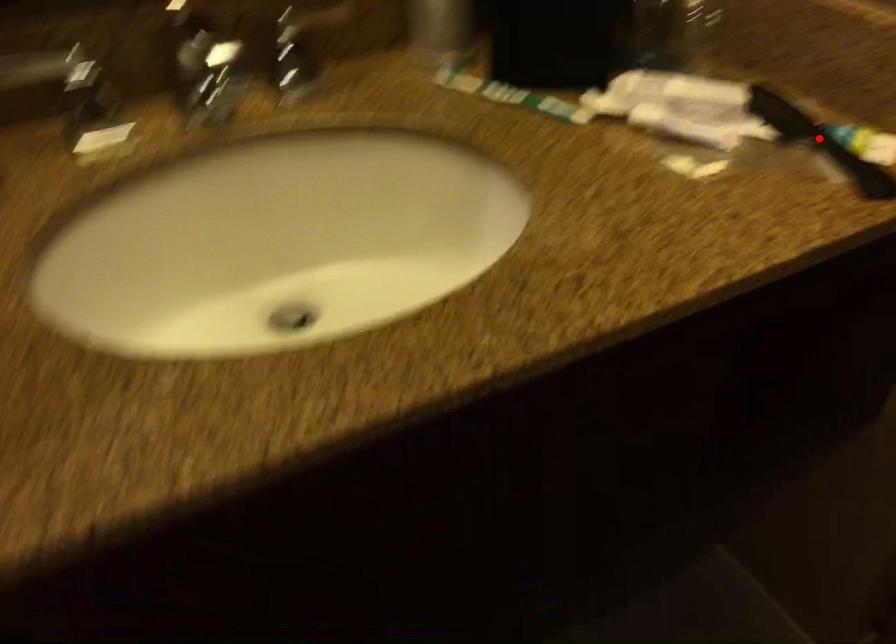
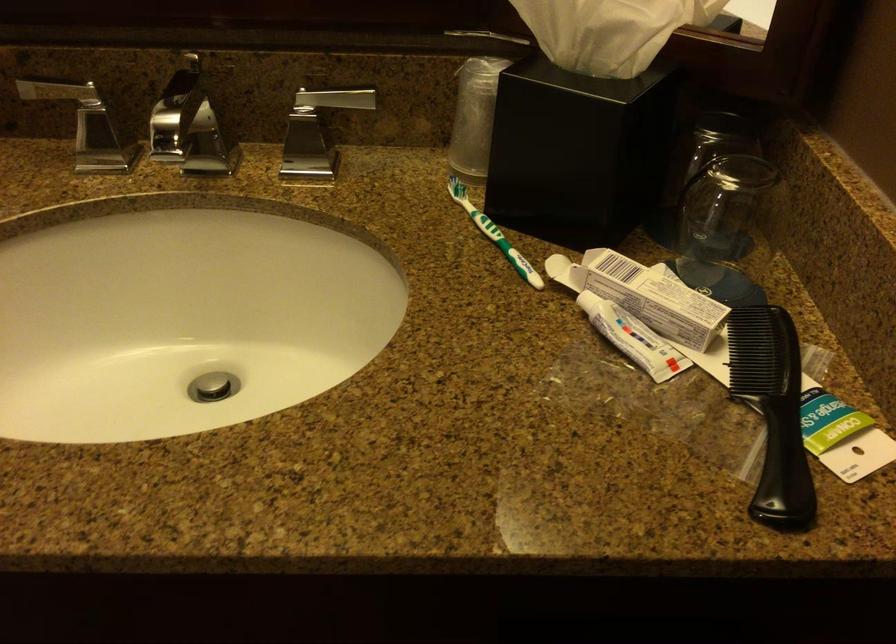
Locate, in the second image, the point that corresponds to the highlighted location in the first image.

(772, 411)